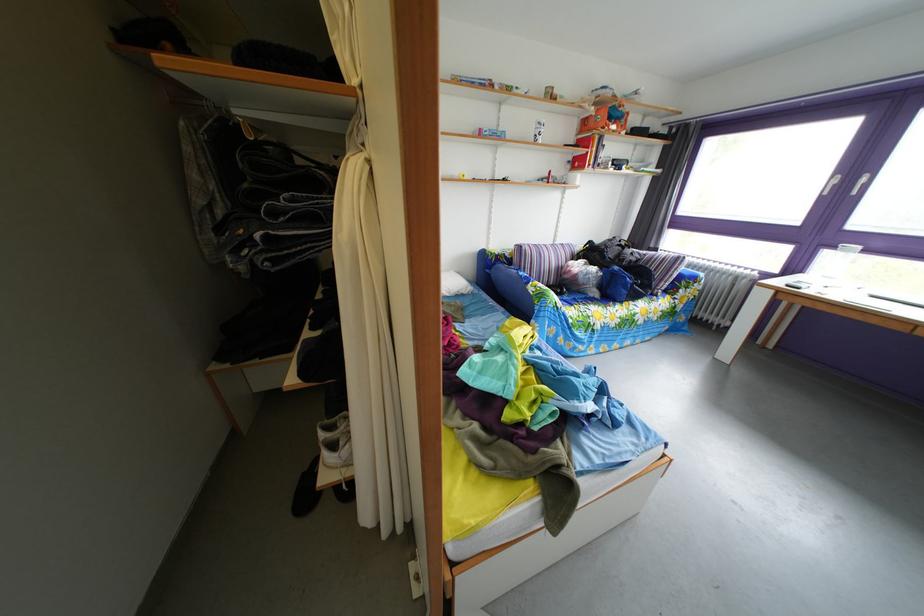
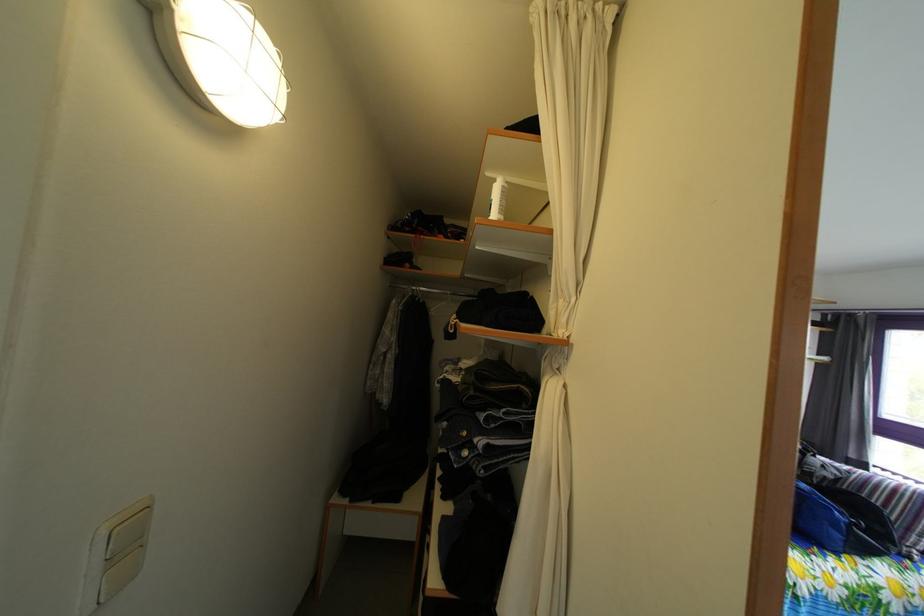
Locate, in the second image, the point that corresponds to point (344, 201) in the first image.

(545, 416)